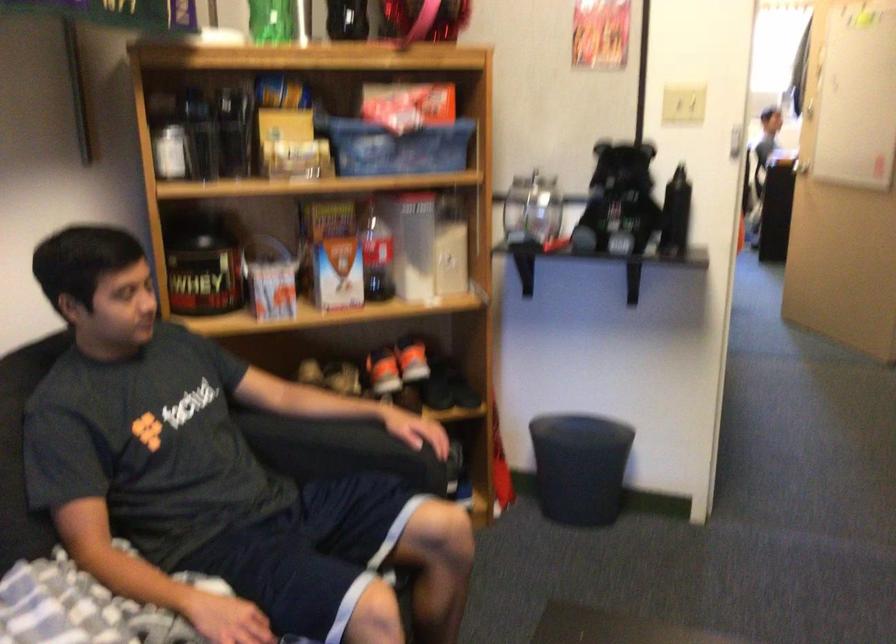
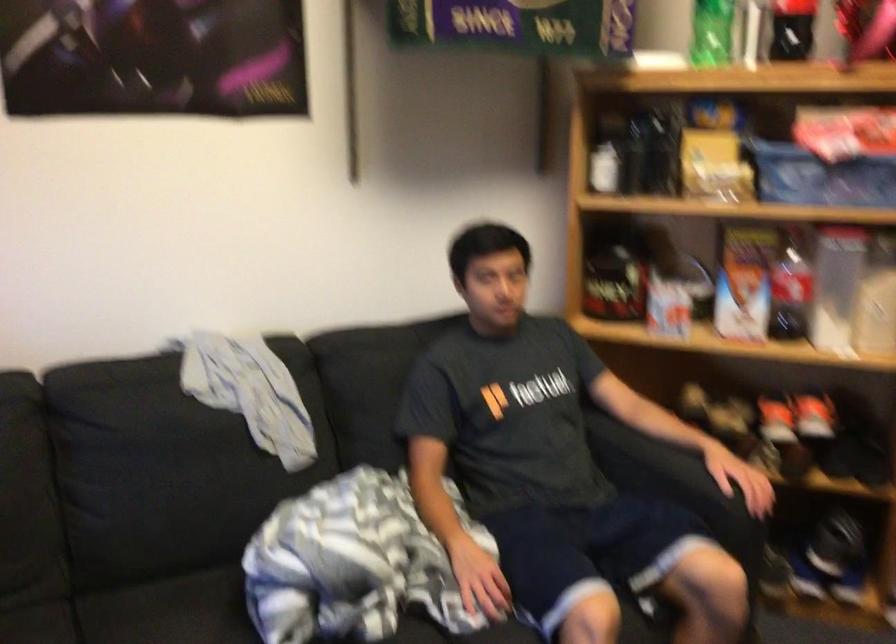
Locate, in the second image, the point that corresponds to point (407, 248) in the first image.

(836, 287)